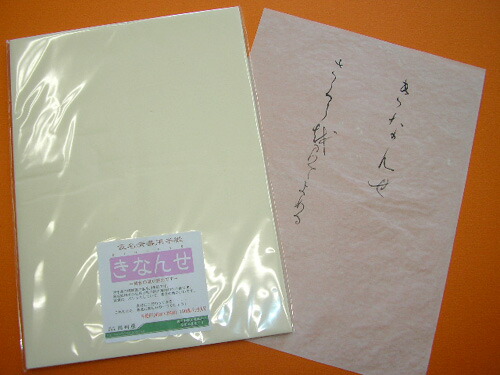
You are a GUI agent. You are given a task and a screenshot of the screen. Output one action in this format:
    pyautogui.click(x=<x>, y=<y>)
    Task: Click on the tissue paper
    This screenshot has width=500, height=375.
    Given the screenshot: What is the action you would take?
    pyautogui.click(x=346, y=236), pyautogui.click(x=186, y=120)